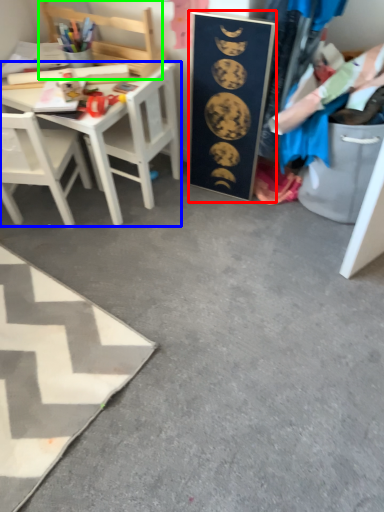
Question: Estimate the real-world distances between objects in this image. Which object is closer to bulletin board (highlighted by a red box), desk (highlighted by a blue box) or chair (highlighted by a green box)?

Choices:
 (A) desk
 (B) chair

Answer: (A)